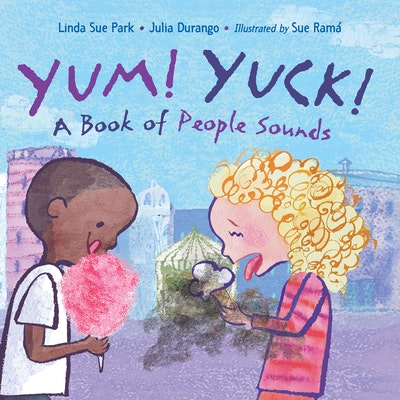
Image resolution: width=400 pixels, height=400 pixels. Find the location of `book`. book is located at coordinates (95, 126).